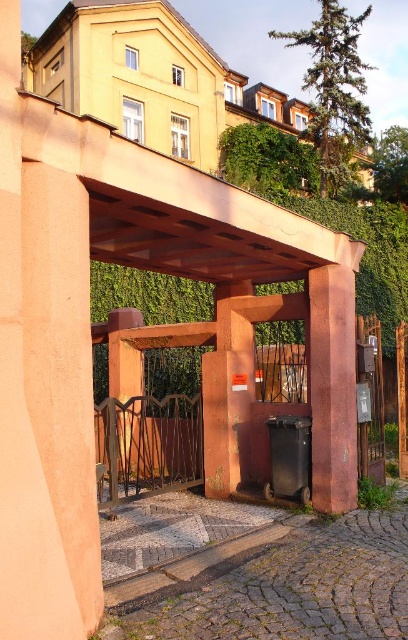
You are a delivery person trying to enter the building through the brown wood gate at center. There is a rustic stone pillar at center blocking your path. Can you drive your van through the space between them?

The rustic stone pillar at center is smaller than the brown wood gate at center, so the space between them is narrower than the width of the brown wood gate at center. Since the van requires a certain amount of space to pass, it might not fit through the narrower gap between the rustic stone pillar at center and the brown wood gate at center.

Consider the image. You are a delivery person approaching the entrance. You need to pass through the brown wood gate at center to deliver a package. Is the rustic stone pillar at center blocking your path to the gate?

The rustic stone pillar at center is in front of the brown wood gate at center, so it is blocking your path to the gate.